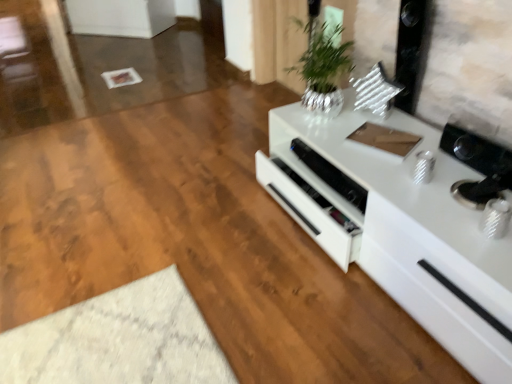
Image resolution: width=512 pixels, height=384 pixels. I want to click on white glossy cabinet at right, so click(398, 229).

What is the approximate height of white glossy speaker at center?

The height of white glossy speaker at center is 3.09 inches.

What do you see at coordinates (331, 175) in the screenshot?
I see `white glossy speaker at center` at bounding box center [331, 175].

Where is `white glossy cabinet at right`? white glossy cabinet at right is located at coordinates (398, 229).

Between white glossy speaker at center and silver metallic vase at upper center, which one has more height?

silver metallic vase at upper center is taller.

Which of these two, white glossy speaker at center or silver metallic vase at upper center, is bigger?

silver metallic vase at upper center.

Between point (322, 167) and point (320, 66), which one is positioned behind?

The point (322, 167) is farther from the camera.

Could you tell me if white glossy speaker at center is facing silver metallic vase at upper center?

No, white glossy speaker at center is not oriented towards silver metallic vase at upper center.

How much distance is there between white glossy cabinet at right and white glossy speaker at center?

white glossy cabinet at right and white glossy speaker at center are 6.27 inches apart.

The height and width of the screenshot is (384, 512). Find the location of `appliance behind the white glossy cabinet at right`. appliance behind the white glossy cabinet at right is located at coordinates (331, 175).

From the image's perspective, is white glossy cabinet at right under white glossy speaker at center?

Correct, white glossy cabinet at right appears lower than white glossy speaker at center in the image.

From a real-world perspective, which is physically above, white glossy cabinet at right or white glossy speaker at center?

white glossy speaker at center is physically above.

Is point (357, 197) positioned in front of point (368, 147)?

Yes.

At what (x,y) coordinates should I click in order to perform the action: click on countertop on the right side of white glossy speaker at center. Please return your answer as a coordinate pair (x, y). The width and height of the screenshot is (512, 384). Looking at the image, I should click on point(398,229).

Which of these two, white glossy speaker at center or white glossy cabinet at right, stands taller?

white glossy cabinet at right.

Considering the sizes of objects white glossy speaker at center and white glossy cabinet at right in the image provided, who is bigger, white glossy speaker at center or white glossy cabinet at right?

white glossy cabinet at right is bigger.

Identify the location of appliance lying below the silver metallic vase at upper center (from the image's perspective). This screenshot has width=512, height=384. tap(331, 175).

Can you confirm if silver metallic vase at upper center is shorter than white glossy speaker at center?

Incorrect, the height of silver metallic vase at upper center does not fall short of that of white glossy speaker at center.

Which object is wider, silver metallic vase at upper center or white glossy speaker at center?

Wider between the two is silver metallic vase at upper center.

Is silver metallic vase at upper center smaller than white glossy speaker at center?

Incorrect, silver metallic vase at upper center is not smaller in size than white glossy speaker at center.

Choose the correct answer: Is white glossy cabinet at right inside silver metallic vase at upper center or outside it?

white glossy cabinet at right is located beyond the bounds of silver metallic vase at upper center.

Is white glossy cabinet at right looking in the opposite direction of silver metallic vase at upper center?

No, white glossy cabinet at right is not facing away from silver metallic vase at upper center.

Does point (496, 303) come farther from viewer compared to point (340, 58)?

No, (496, 303) is in front of (340, 58).

Looking at the image, does white glossy cabinet at right seem bigger or smaller compared to silver metallic vase at upper center?

Considering their sizes, white glossy cabinet at right takes up more space than silver metallic vase at upper center.

Considering the positions of objects silver metallic vase at upper center and white glossy cabinet at right in the image provided, who is more to the right, silver metallic vase at upper center or white glossy cabinet at right?

white glossy cabinet at right is more to the right.

From the picture: Is silver metallic vase at upper center looking in the opposite direction of white glossy cabinet at right?

No, silver metallic vase at upper center is not facing away from white glossy cabinet at right.

Is silver metallic vase at upper center not within white glossy cabinet at right?

silver metallic vase at upper center lies outside white glossy cabinet at right's area.

Looking at the image, does silver metallic vase at upper center seem bigger or smaller compared to white glossy cabinet at right?

silver metallic vase at upper center is smaller than white glossy cabinet at right.

The height and width of the screenshot is (384, 512). Identify the location of houseplant positioned vertically above the white glossy speaker at center (from a real-world perspective). (322, 68).

This screenshot has height=384, width=512. What are the coordinates of `countertop on the right of white glossy speaker at center` in the screenshot? It's located at (398, 229).

Looking at the image, which one is located closer to silver metallic vase at upper center, white glossy cabinet at right or white glossy speaker at center?

white glossy speaker at center.

Estimate the real-world distances between objects in this image. Which object is closer to white glossy speaker at center, silver metallic vase at upper center or white glossy cabinet at right?

Among the two, white glossy cabinet at right is located nearer to white glossy speaker at center.

When comparing their distances from white glossy cabinet at right, does white glossy speaker at center or silver metallic vase at upper center seem further?

silver metallic vase at upper center.

Considering their positions, is silver metallic vase at upper center positioned further to white glossy cabinet at right than white glossy speaker at center?

silver metallic vase at upper center.

Based on their spatial positions, is white glossy cabinet at right or silver metallic vase at upper center further from white glossy speaker at center?

silver metallic vase at upper center is positioned further to the anchor white glossy speaker at center.

From the image, which object appears to be nearer to silver metallic vase at upper center, white glossy speaker at center or white glossy cabinet at right?

The object closer to silver metallic vase at upper center is white glossy speaker at center.

The image size is (512, 384). Find the location of `houseplant between white glossy cabinet at right and white glossy speaker at center along the z-axis`. houseplant between white glossy cabinet at right and white glossy speaker at center along the z-axis is located at coordinates (322, 68).